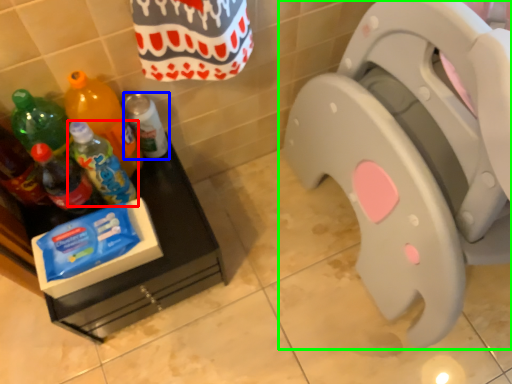
Question: Estimate the real-world distances between objects in this image. Which object is farther from bottle (highlighted by a red box), bottle (highlighted by a blue box) or toilet (highlighted by a green box)?

Choices:
 (A) bottle
 (B) toilet

Answer: (B)